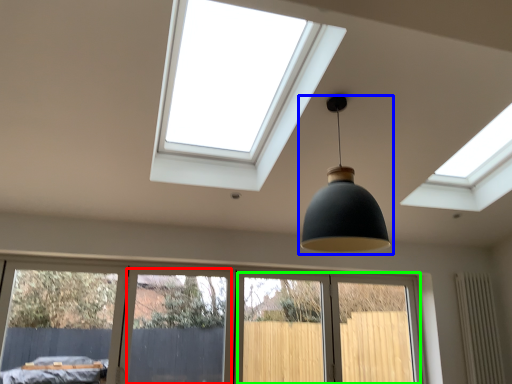
Question: Considering the real-world distances, which object is farthest from screen door (highlighted by a red box)? lamp (highlighted by a blue box) or screen door (highlighted by a green box)?

Choices:
 (A) lamp
 (B) screen door

Answer: (A)